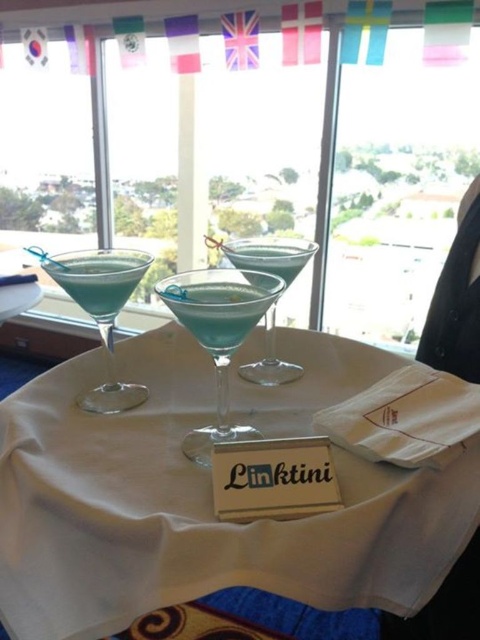
You are holding a camera at a height of 5 feet. You want to take a photo of the point at coordinates point [229,432]. The camera is currently 24.56 inches away from the point. Is the camera positioned too close to take a clear photo?

The point [229,432] is 24.56 inches away from the camera. Since the camera is at 5 feet height, which is 60 inches, the distance is appropriate for a clear photo as 24.56 inches is within a typical focus range.

You are a bartender arranging drinks on a table. You need to place a new drink exactly where the matte glass cocktail at center is currently located. Where should you place the new drink relative to the wooden card holder with the word Linktini?

The matte glass cocktail at center is located at point (218,333) relative to the wooden card holder with the word Linktini. You should place the new drink at those coordinates to match its current position.